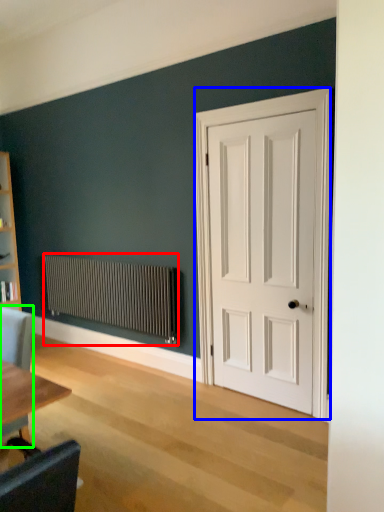
Question: Considering the real-world distances, which object is farthest from radiator (highlighted by a red box)? door (highlighted by a blue box) or chair (highlighted by a green box)?

Choices:
 (A) door
 (B) chair

Answer: (B)